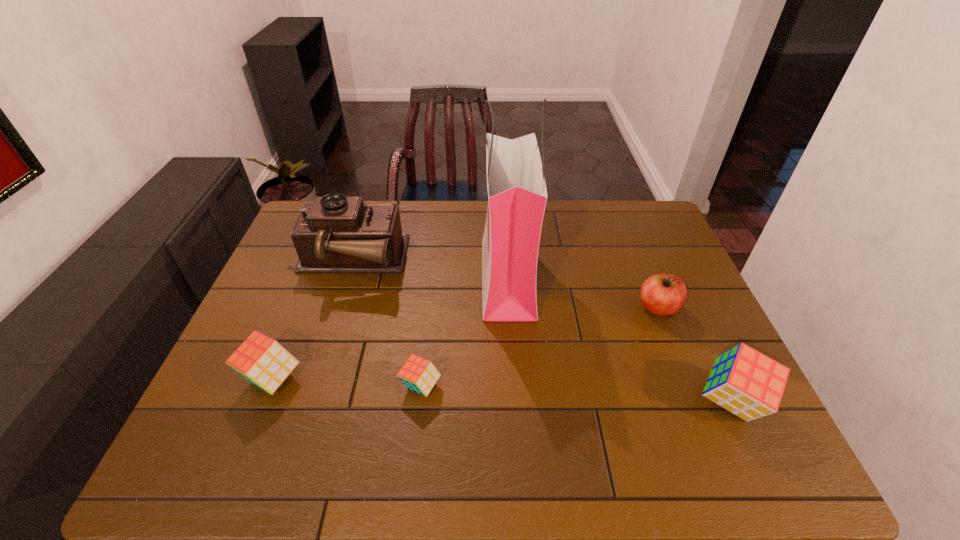
Locate an element on the screen. This screenshot has width=960, height=540. the second shortest cube is located at coordinates (263, 361).

You are a GUI agent. You are given a task and a screenshot of the screen. Output one action in this format:
    pyautogui.click(x=<x>, y=<y>)
    Task: Click on the shortest cube
    Image resolution: width=960 pixels, height=540 pixels.
    Given the screenshot: What is the action you would take?
    pyautogui.click(x=418, y=374)

Find the location of `the fourth object from right to left`. the fourth object from right to left is located at coordinates (418, 374).

The height and width of the screenshot is (540, 960). Identify the location of the rightmost cube. (749, 384).

Where is `the third object from right to left`? This screenshot has height=540, width=960. the third object from right to left is located at coordinates (517, 195).

This screenshot has height=540, width=960. I want to click on the tallest object, so click(x=517, y=195).

Locate an element on the screen. Image resolution: width=960 pixels, height=540 pixels. apple is located at coordinates (662, 294).

You are a GUI agent. You are given a task and a screenshot of the screen. Output one action in this format:
    pyautogui.click(x=<x>, y=<y>)
    Task: Click on the phonograph_record
    Image resolution: width=960 pixels, height=540 pixels.
    Given the screenshot: What is the action you would take?
    pyautogui.click(x=335, y=234)

You are a GUI agent. You are given a task and a screenshot of the screen. Output one action in this format:
    pyautogui.click(x=<x>, y=<y>)
    Task: Click on the vacant space situated 0.340m on the right of the leftmost cube
    The height and width of the screenshot is (540, 960).
    Given the screenshot: What is the action you would take?
    pyautogui.click(x=443, y=378)

Where is `vacant space located on the left of the shortest cube`? The width and height of the screenshot is (960, 540). vacant space located on the left of the shortest cube is located at coordinates (262, 386).